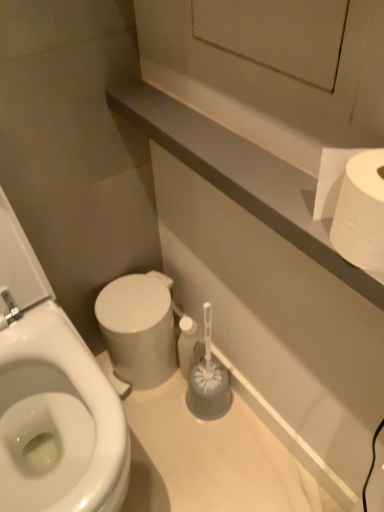
Where is `white matte toilet paper at upper right`? The height and width of the screenshot is (512, 384). white matte toilet paper at upper right is located at coordinates (361, 213).

What do you see at coordinates (361, 213) in the screenshot? I see `white matte toilet paper at upper right` at bounding box center [361, 213].

The height and width of the screenshot is (512, 384). I want to click on white matte toilet paper at upper right, so click(x=361, y=213).